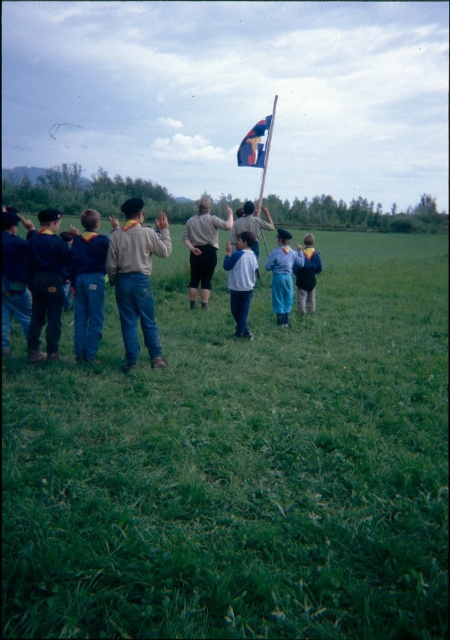
You are a participant in the scouting activity and need to place a small flag exactly where the light brown fabric shirt at center is located. However, the flag must be planted on the green grassy field at center. Is this possible based on the scene description?

The green grassy field at center is below the light brown fabric shirt at center, so yes, the flag can be planted on the green grassy field at center directly beneath the light brown fabric shirt at center.

Based on the coordinates provided, where is the green grassy field at center located in the image?

The green grassy field at center is located at point coordinates of 0.728 on the x axis and 0.536 on the y axis.